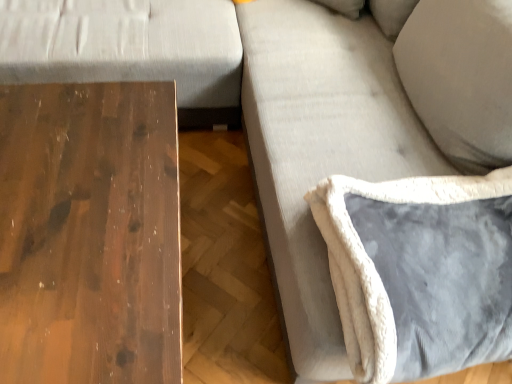
This screenshot has height=384, width=512. What do you see at coordinates (372, 260) in the screenshot?
I see `velvet gray pillow at lower right` at bounding box center [372, 260].

Where is `velvet gray pillow at lower right`? velvet gray pillow at lower right is located at coordinates (372, 260).

What is the approximate width of velvet gray pillow at lower right?

It is 23.23 inches.

The image size is (512, 384). What do you see at coordinates (89, 234) in the screenshot?
I see `shiny brown wood table at left` at bounding box center [89, 234].

Locate an element on the screen. The height and width of the screenshot is (384, 512). shiny brown wood table at left is located at coordinates (89, 234).

The image size is (512, 384). In order to click on velvet gray pillow at lower right in this screenshot , I will do `click(372, 260)`.

Is shiny brown wood table at left at the right side of velvet gray pillow at lower right?

No, shiny brown wood table at left is not to the right of velvet gray pillow at lower right.

Is shiny brown wood table at left behind velvet gray pillow at lower right?

No, the depth of shiny brown wood table at left is less than that of velvet gray pillow at lower right.

Which is less distant, (88, 146) or (386, 345)?

The point (386, 345) is more forward.

From the image's perspective, which object appears higher, shiny brown wood table at left or velvet gray pillow at lower right?

From the image's view, velvet gray pillow at lower right is above.

From a real-world perspective, which is physically below, shiny brown wood table at left or velvet gray pillow at lower right?

In real-world perspective, shiny brown wood table at left is lower.

Which of these two, shiny brown wood table at left or velvet gray pillow at lower right, is wider?

With larger width is shiny brown wood table at left.

Who is shorter, shiny brown wood table at left or velvet gray pillow at lower right?

With less height is velvet gray pillow at lower right.

Is shiny brown wood table at left bigger than velvet gray pillow at lower right?

Yes, shiny brown wood table at left is bigger than velvet gray pillow at lower right.

Is shiny brown wood table at left situated inside velvet gray pillow at lower right or outside?

shiny brown wood table at left lies outside velvet gray pillow at lower right.

Is shiny brown wood table at left touching velvet gray pillow at lower right?

shiny brown wood table at left and velvet gray pillow at lower right are clearly separated.

Is shiny brown wood table at left facing away from velvet gray pillow at lower right?

No, velvet gray pillow at lower right is not at the back of shiny brown wood table at left.

How far apart are shiny brown wood table at left and velvet gray pillow at lower right?

shiny brown wood table at left is 21.43 inches from velvet gray pillow at lower right.

Locate an element on the screen. This screenshot has height=384, width=512. table in front of the velvet gray pillow at lower right is located at coordinates click(89, 234).

Based on the photo, visually, is velvet gray pillow at lower right positioned to the left or to the right of shiny brown wood table at left?

Clearly, velvet gray pillow at lower right is on the right of shiny brown wood table at left in the image.

Considering their positions, is velvet gray pillow at lower right located in front of or behind shiny brown wood table at left?

velvet gray pillow at lower right is behind shiny brown wood table at left.

Considering the points (348, 242) and (160, 254), which point is behind, point (348, 242) or point (160, 254)?

The point (348, 242) is farther.

From the image's perspective, between velvet gray pillow at lower right and shiny brown wood table at left, who is located below?

shiny brown wood table at left.

In the scene shown: From a real-world perspective, is velvet gray pillow at lower right on shiny brown wood table at left?

Yes, from a real-world perspective, velvet gray pillow at lower right is on top of shiny brown wood table at left.

Considering the relative sizes of velvet gray pillow at lower right and shiny brown wood table at left in the image provided, is velvet gray pillow at lower right wider than shiny brown wood table at left?

No, velvet gray pillow at lower right is not wider than shiny brown wood table at left.

Which of these two, velvet gray pillow at lower right or shiny brown wood table at left, stands shorter?

Standing shorter between the two is velvet gray pillow at lower right.

From the picture: Considering the sizes of objects velvet gray pillow at lower right and shiny brown wood table at left in the image provided, who is smaller, velvet gray pillow at lower right or shiny brown wood table at left?

velvet gray pillow at lower right.

Is velvet gray pillow at lower right located outside shiny brown wood table at left?

Yes, velvet gray pillow at lower right is outside of shiny brown wood table at left.

Is velvet gray pillow at lower right positioned far away from shiny brown wood table at left?

No, there isn't a large distance between velvet gray pillow at lower right and shiny brown wood table at left.

Is velvet gray pillow at lower right looking in the opposite direction of shiny brown wood table at left?

velvet gray pillow at lower right is not turned away from shiny brown wood table at left.

Measure the distance between velvet gray pillow at lower right and shiny brown wood table at left.

velvet gray pillow at lower right and shiny brown wood table at left are 21.43 inches apart.

In order to click on table that is on the left side of velvet gray pillow at lower right in this screenshot , I will do `click(89, 234)`.

Identify the location of pillow that appears on the right of shiny brown wood table at left. The image size is (512, 384). (372, 260).

At what (x,y) coordinates should I click in order to perform the action: click on table below the velvet gray pillow at lower right (from a real-world perspective). Please return your answer as a coordinate pair (x, y). The width and height of the screenshot is (512, 384). Looking at the image, I should click on (89, 234).